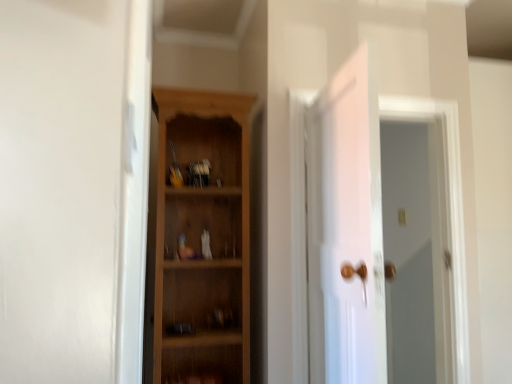
Question: From a real-world perspective, is white glossy door at center over wooden cabinet at center?

Choices:
 (A) yes
 (B) no

Answer: (B)

Question: Are white glossy door at center and wooden cabinet at center located far from each other?

Choices:
 (A) yes
 (B) no

Answer: (B)

Question: Does white glossy door at center have a larger size compared to wooden cabinet at center?

Choices:
 (A) yes
 (B) no

Answer: (A)

Question: Is white glossy door at center oriented away from wooden cabinet at center?

Choices:
 (A) yes
 (B) no

Answer: (B)

Question: From the image's perspective, is white glossy door at center on top of wooden cabinet at center?

Choices:
 (A) no
 (B) yes

Answer: (A)

Question: From a real-world perspective, is white glossy door at center beneath wooden cabinet at center?

Choices:
 (A) yes
 (B) no

Answer: (A)

Question: Is white glossy door at upper right at the left side of wooden cabinet at center?

Choices:
 (A) no
 (B) yes

Answer: (A)

Question: Can you confirm if white glossy door at upper right is wider than wooden cabinet at center?

Choices:
 (A) yes
 (B) no

Answer: (A)

Question: Is white glossy door at upper right at the right side of wooden cabinet at center?

Choices:
 (A) no
 (B) yes

Answer: (B)

Question: Can you confirm if white glossy door at upper right is smaller than wooden cabinet at center?

Choices:
 (A) no
 (B) yes

Answer: (B)

Question: From the image's perspective, is white glossy door at upper right located beneath wooden cabinet at center?

Choices:
 (A) no
 (B) yes

Answer: (B)

Question: Is white glossy door at upper right looking in the opposite direction of wooden cabinet at center?

Choices:
 (A) yes
 (B) no

Answer: (B)

Question: Is white glossy door at center to the left of white glossy door at upper right from the viewer's perspective?

Choices:
 (A) yes
 (B) no

Answer: (A)